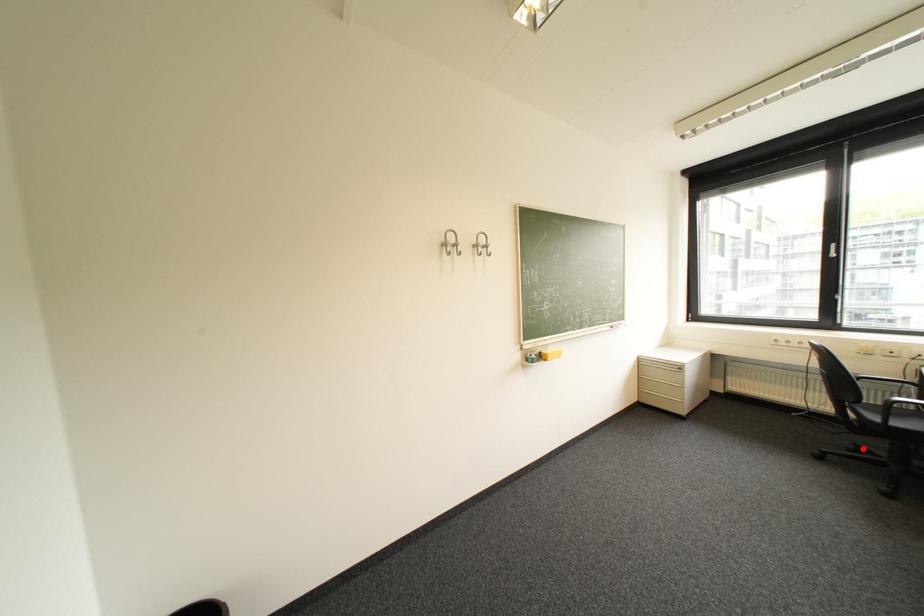
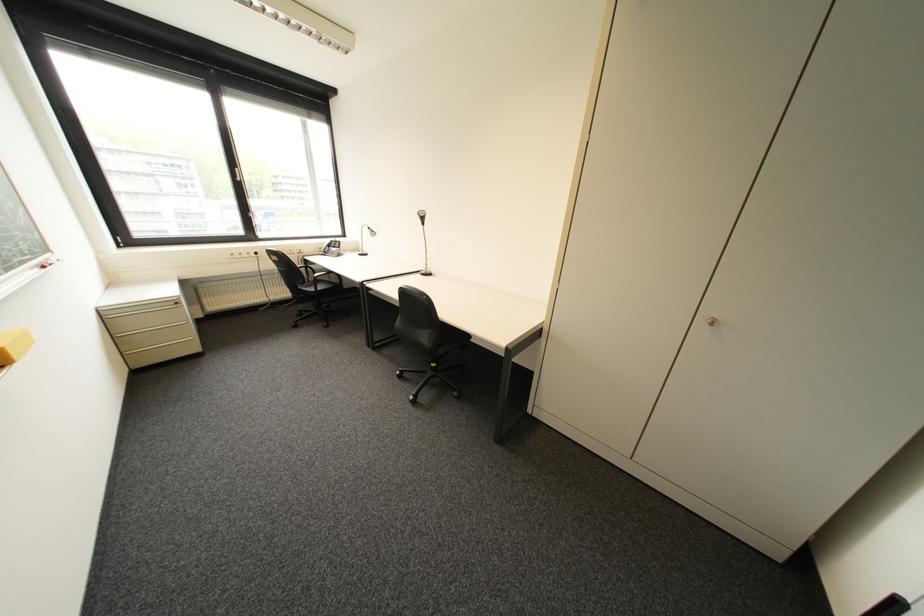
Question: A red point is marked in image1. In image2, is the corresponding 3D point closer to the camera or farther? Reply with the corresponding letter.

Choices:
 (A) The corresponding 3D point is closer.
 (B) The corresponding 3D point is farther.

Answer: (A)